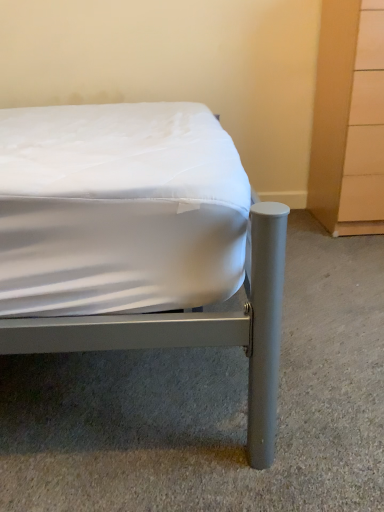
Question: Does metallic gray bed at center have a smaller size compared to light wood dresser at right?

Choices:
 (A) yes
 (B) no

Answer: (B)

Question: Does metallic gray bed at center have a greater width compared to light wood dresser at right?

Choices:
 (A) yes
 (B) no

Answer: (A)

Question: From a real-world perspective, is metallic gray bed at center below light wood dresser at right?

Choices:
 (A) yes
 (B) no

Answer: (B)

Question: From a real-world perspective, is metallic gray bed at center over light wood dresser at right?

Choices:
 (A) yes
 (B) no

Answer: (A)

Question: Is metallic gray bed at center further to camera compared to light wood dresser at right?

Choices:
 (A) no
 (B) yes

Answer: (A)

Question: Can light wood dresser at right be found inside metallic gray bed at center?

Choices:
 (A) no
 (B) yes

Answer: (A)

Question: Does light wood dresser at right have a greater width compared to metallic gray bed at center?

Choices:
 (A) yes
 (B) no

Answer: (B)

Question: Is light wood dresser at right positioned with its back to metallic gray bed at center?

Choices:
 (A) yes
 (B) no

Answer: (B)

Question: Is light wood dresser at right not within metallic gray bed at center?

Choices:
 (A) yes
 (B) no

Answer: (A)

Question: Is light wood dresser at right beside metallic gray bed at center?

Choices:
 (A) yes
 (B) no

Answer: (B)

Question: Is light wood dresser at right far away from metallic gray bed at center?

Choices:
 (A) yes
 (B) no

Answer: (B)

Question: Considering the relative sizes of light wood dresser at right and metallic gray bed at center in the image provided, is light wood dresser at right bigger than metallic gray bed at center?

Choices:
 (A) yes
 (B) no

Answer: (B)

Question: From a real-world perspective, is metallic gray bed at center positioned above or below light wood dresser at right?

Choices:
 (A) above
 (B) below

Answer: (A)